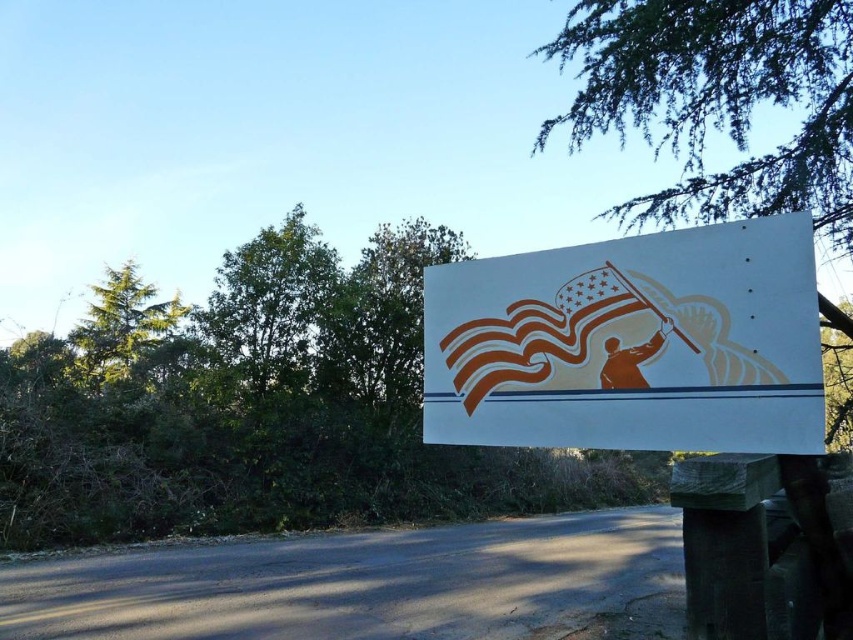
Question: Considering the real-world distances, which object is closest to the green needle-like branches at upper right?

Choices:
 (A) green leafy tree at upper left
 (B) white matte sign at center

Answer: (B)

Question: Can you confirm if green needle-like branches at upper right is positioned below green leafy tree at upper left?

Choices:
 (A) yes
 (B) no

Answer: (B)

Question: Which of the following is the farthest from the observer?

Choices:
 (A) white matte sign at center
 (B) green needle-like branches at upper right
 (C) green leafy tree at upper left

Answer: (C)

Question: Is white matte sign at center above green leafy tree at upper left?

Choices:
 (A) yes
 (B) no

Answer: (A)

Question: Is white matte sign at center above green leafy tree at upper left?

Choices:
 (A) yes
 (B) no

Answer: (A)

Question: Which point is closer to the camera taking this photo?

Choices:
 (A) (97, 289)
 (B) (851, 128)
 (C) (427, 272)

Answer: (C)